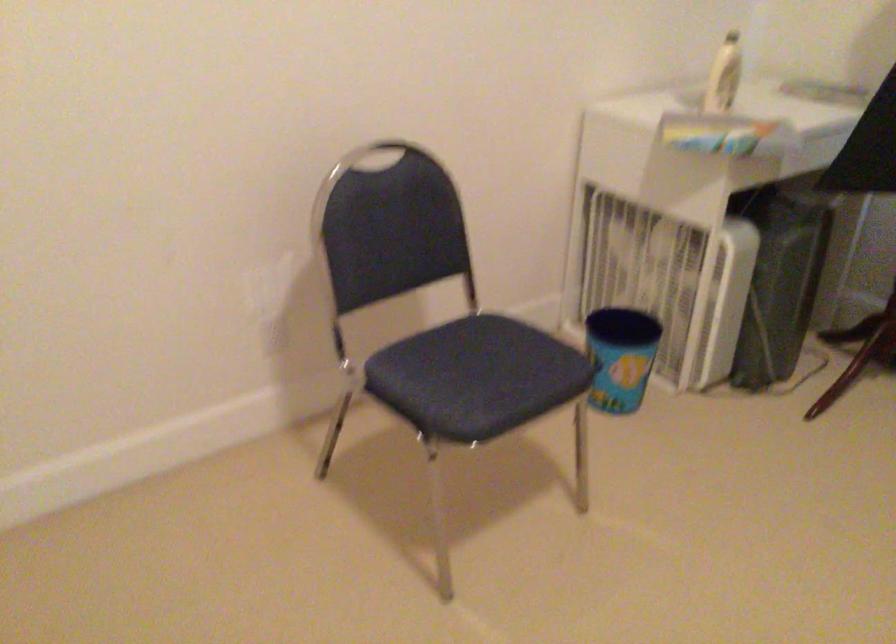
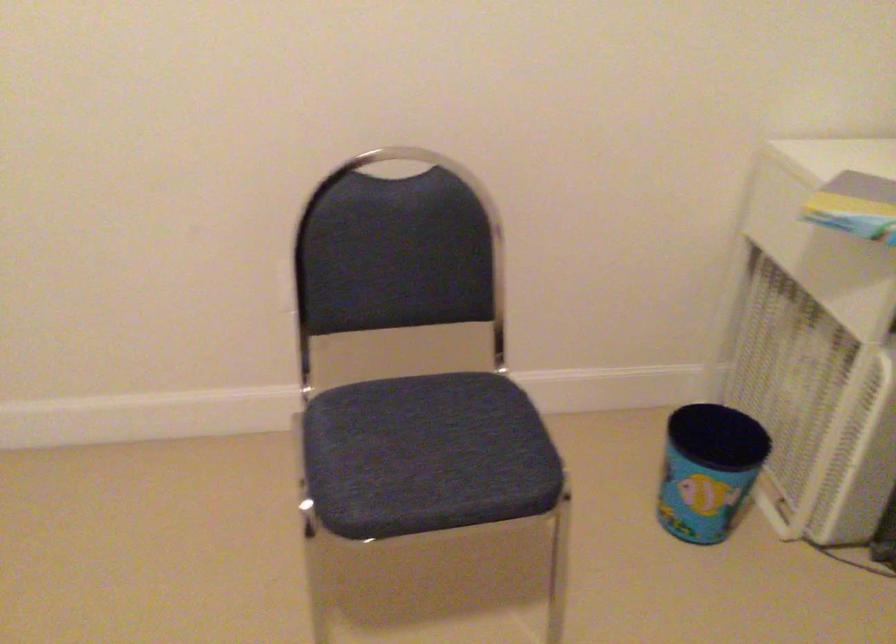
In the second image, find the point that corresponds to pixel 631 351 in the first image.

(708, 469)